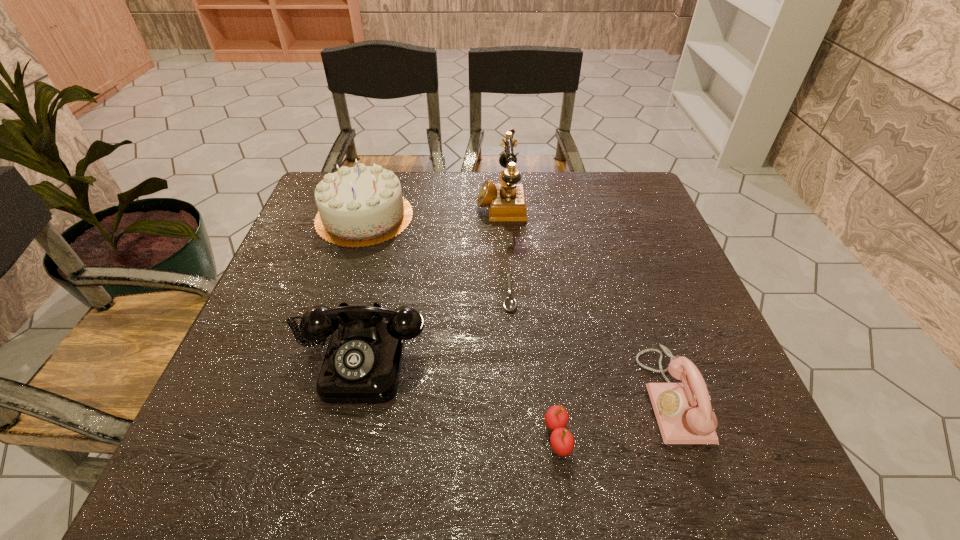
Find the location of a particular element. This screenshot has width=960, height=540. the tallest telephone is located at coordinates (506, 201).

I want to click on the tallest object, so click(x=506, y=201).

Identify the location of birthday cake. (360, 206).

This screenshot has width=960, height=540. Identify the location of the leftmost telephone. (362, 364).

This screenshot has height=540, width=960. Find the location of `the rightmost telephone`. the rightmost telephone is located at coordinates (683, 411).

I want to click on the fifth tallest object, so click(x=556, y=418).

Where is `soupspoon`? This screenshot has height=540, width=960. soupspoon is located at coordinates (510, 303).

This screenshot has height=540, width=960. Identify the location of the fourth nearest object. (510, 303).

Where is `free space located on the dial number of the farthest telephone`? The image size is (960, 540). free space located on the dial number of the farthest telephone is located at coordinates (340, 202).

Identify the location of free spot located on the dial number of the farthest telephone. (414, 202).